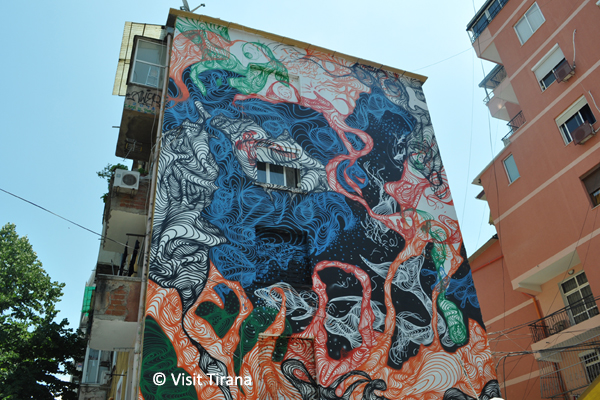
Identify the location of painted over windows. (287, 255), (289, 364).